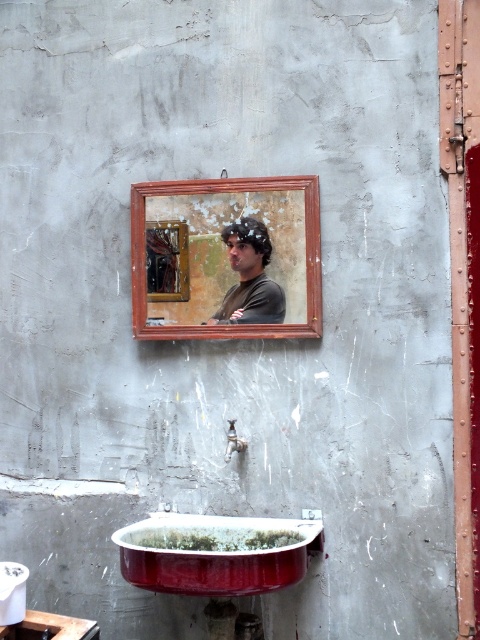
Question: Can you confirm if wooden frame at upper center is thinner than matte silver faucet at lower center?

Choices:
 (A) no
 (B) yes

Answer: (A)

Question: Does wooden frame at upper center appear on the right side of matte black shirt at center?

Choices:
 (A) yes
 (B) no

Answer: (B)

Question: Which point is farther from the camera taking this photo?

Choices:
 (A) (238, 237)
 (B) (122, 540)

Answer: (A)

Question: Does wooden frame at upper center appear under matte silver faucet at lower center?

Choices:
 (A) yes
 (B) no

Answer: (B)

Question: Which object is closer to the camera taking this photo?

Choices:
 (A) matte black shirt at center
 (B) matte silver faucet at lower center
 (C) wooden frame at upper center
 (D) red enameled sink at lower center

Answer: (D)

Question: Which of the following is the farthest from the observer?

Choices:
 (A) (218, 209)
 (B) (237, 444)
 (C) (283, 296)
 (D) (132, 560)

Answer: (A)